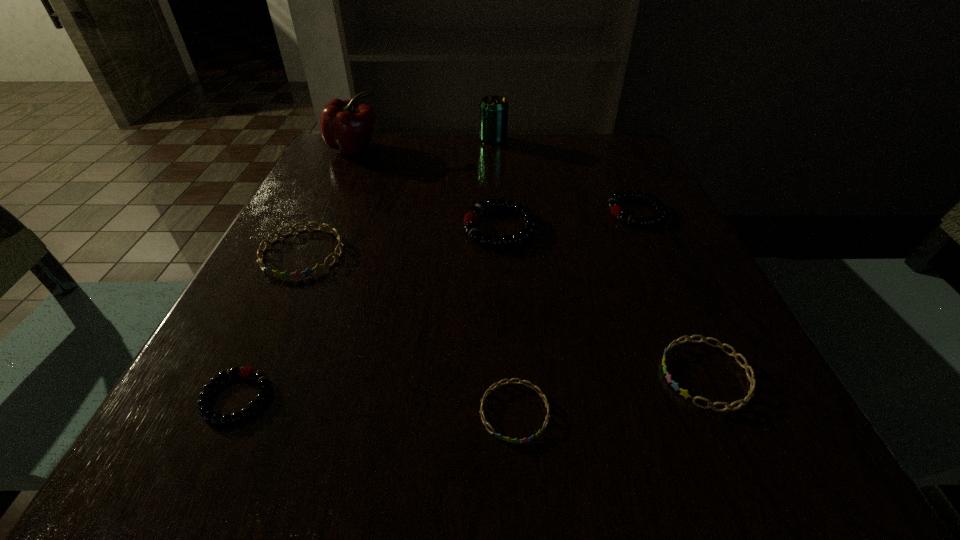
You are a GUI agent. You are given a task and a screenshot of the screen. Output one action in this format:
    pyautogui.click(x=<x>, y=<y>)
    Task: Click on the free region located 0.370m on the surface of the rightmost blue bracelet showing star-shaped elements
    Image resolution: width=960 pixels, height=540 pixels.
    Given the screenshot: What is the action you would take?
    pyautogui.click(x=395, y=374)

Identify the location of free point located 0.050m on the front of the nearest black bracelet. (204, 467).

Where is `pepper that is at the far edge`? pepper that is at the far edge is located at coordinates (345, 125).

Where is `beer can situated at the far edge`? beer can situated at the far edge is located at coordinates (493, 109).

Find the location of `pepper positioned at the left edge`. pepper positioned at the left edge is located at coordinates (345, 125).

Where is `object that is at the far left corner`? This screenshot has width=960, height=540. object that is at the far left corner is located at coordinates (345, 125).

In order to click on object present at the near left corner in this screenshot , I will do `click(205, 411)`.

The image size is (960, 540). What are the coordinates of `free space at the far edge` in the screenshot? It's located at (409, 132).

Identify the location of vacant position at the near edge of the desktop. This screenshot has width=960, height=540. (372, 420).

This screenshot has height=540, width=960. What are the coordinates of `vacant space at the left edge of the desktop` in the screenshot? It's located at (299, 363).